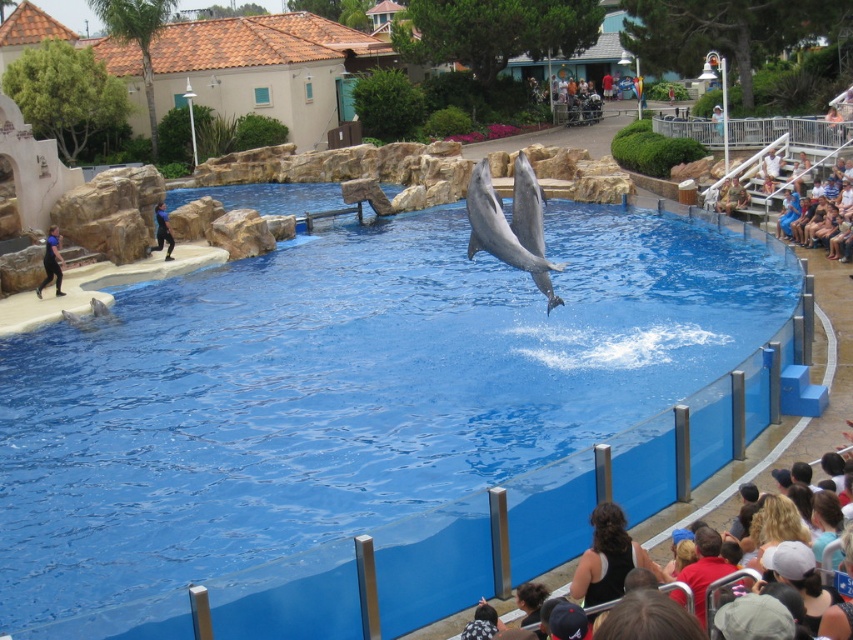
You are a photographer at the dolphin show. You want to take a photo of the gray smooth dolphin at center without any people in the frame. Since you are standing among the audience, which direction should you move to avoid the brown hair at lower right blocking your shot?

Move to the left because the gray smooth dolphin at center is to the left of the brown hair at lower right, so moving left would position you away from the brown hair at lower right and keep the dolphin in view.

You are a photographer trying to capture a clear shot of the dolphins in the pool. There are two objects blocking your view slightly. What is the relationship between the black fabric at lower center and the brown hair at lower right in terms of their positions?

The black fabric at lower center is positioned under the brown hair at lower right, meaning the brown hair is above it and closer to your line of sight.